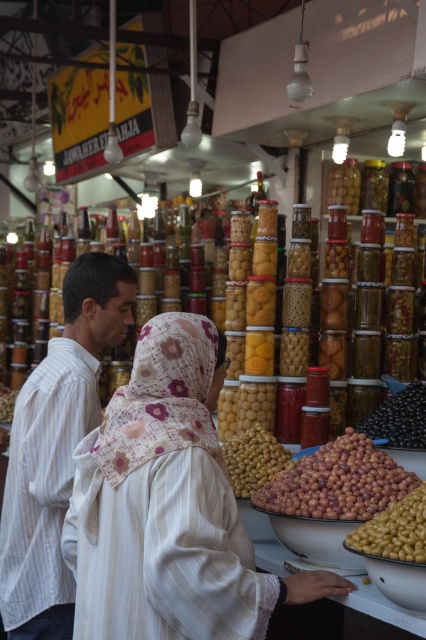
Question: Observing the image, what is the correct spatial positioning of white striped fabric at center in reference to brown matte olives at center?

Choices:
 (A) below
 (B) above

Answer: (B)

Question: Does white striped fabric at center have a smaller size compared to green matte olives at lower right?

Choices:
 (A) no
 (B) yes

Answer: (A)

Question: Which of the following is the farthest from the observer?

Choices:
 (A) brown matte olives at center
 (B) green matte olives at center
 (C) black glossy olives at center

Answer: (C)

Question: Is white striped fabric at center further to the viewer compared to white striped shirt at left?

Choices:
 (A) no
 (B) yes

Answer: (A)

Question: Which point is farther to the camera?

Choices:
 (A) (328, 502)
 (B) (399, 435)
 (C) (166, 365)

Answer: (B)

Question: Which point is closer to the camera?

Choices:
 (A) (388, 419)
 (B) (287, 452)
 (C) (282, 513)
 (D) (14, 554)

Answer: (D)